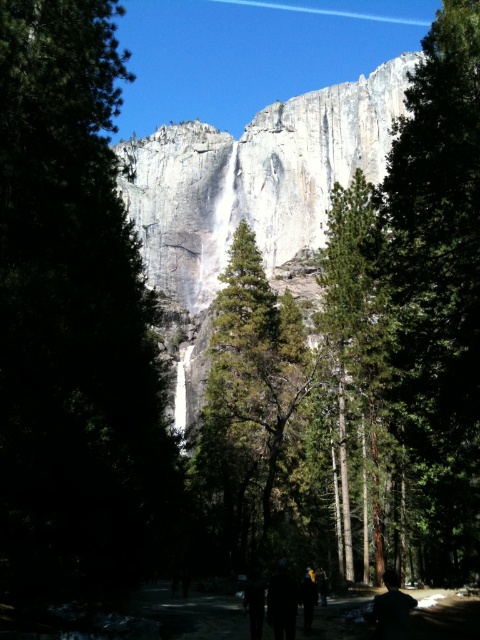
Question: Which of the following is the farthest from the observer?

Choices:
 (A) coord(451,134)
 (B) coord(58,292)
 (C) coord(181,148)
 (D) coord(407,616)

Answer: (C)

Question: Is green rough bark tree at center above black fabric at lower center?

Choices:
 (A) no
 (B) yes

Answer: (B)

Question: Which point is farther to the camera?

Choices:
 (A) (50, 307)
 (B) (146, 180)
 (C) (433, 160)

Answer: (B)

Question: Among these points, which one is farthest from the camera?

Choices:
 (A) 328,308
 (B) 445,515
 (C) 271,419

Answer: (C)

Question: Is green textured tree at left smaller than green matte tree at center?

Choices:
 (A) no
 (B) yes

Answer: (B)

Question: Is white rock face at center to the left of green rough bark tree at center from the viewer's perspective?

Choices:
 (A) yes
 (B) no

Answer: (A)